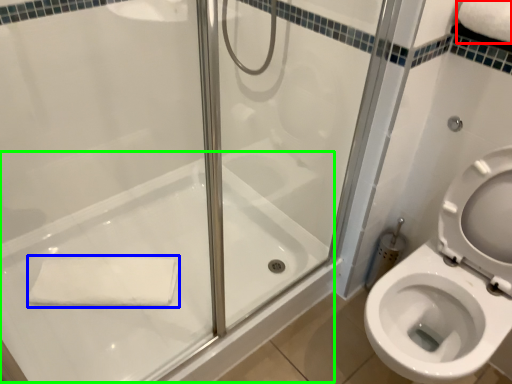
Question: Considering the real-world distances, which object is closest to bath towel (highlighted by a red box)? bath towel (highlighted by a blue box) or bath (highlighted by a green box).

Choices:
 (A) bath towel
 (B) bath

Answer: (B)